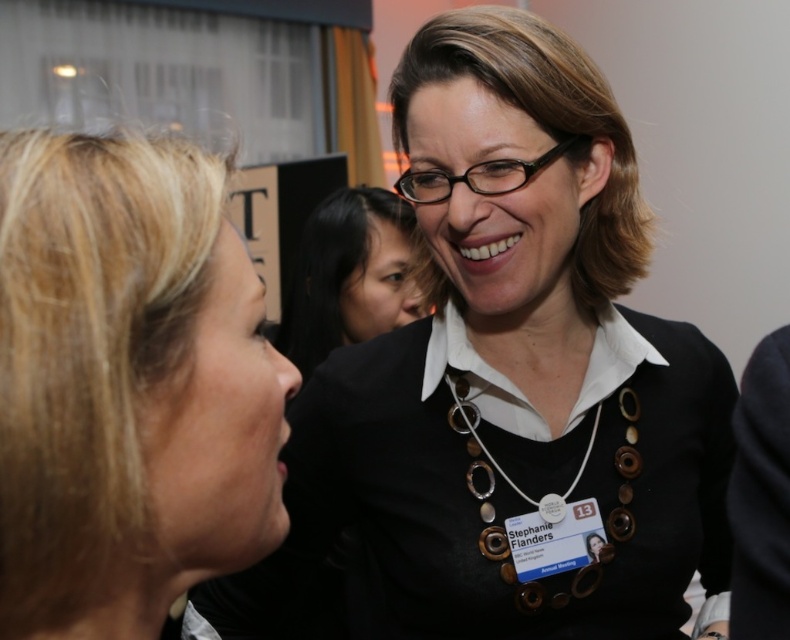
Question: Estimate the real-world distances between objects in this image. Which object is closer to the brown wooden beads at center?

Choices:
 (A) black matte necklace at upper center
 (B) blonde hair at upper left
 (C) matte black shirt at center

Answer: (A)

Question: Can you confirm if matte black shirt at center is positioned above brown wooden beads at center?

Choices:
 (A) no
 (B) yes

Answer: (B)

Question: Is blonde hair at upper left below brown wooden beads at center?

Choices:
 (A) yes
 (B) no

Answer: (B)

Question: Which of the following is the closest to the observer?

Choices:
 (A) brown wooden beads at center
 (B) blonde hair at upper left
 (C) black matte necklace at upper center
 (D) matte black shirt at center

Answer: (B)

Question: Which point is closer to the camera taking this photo?

Choices:
 (A) (401, 205)
 (B) (589, 451)
 (C) (469, 605)

Answer: (C)

Question: Is black matte necklace at upper center below blonde hair at upper left?

Choices:
 (A) no
 (B) yes

Answer: (B)